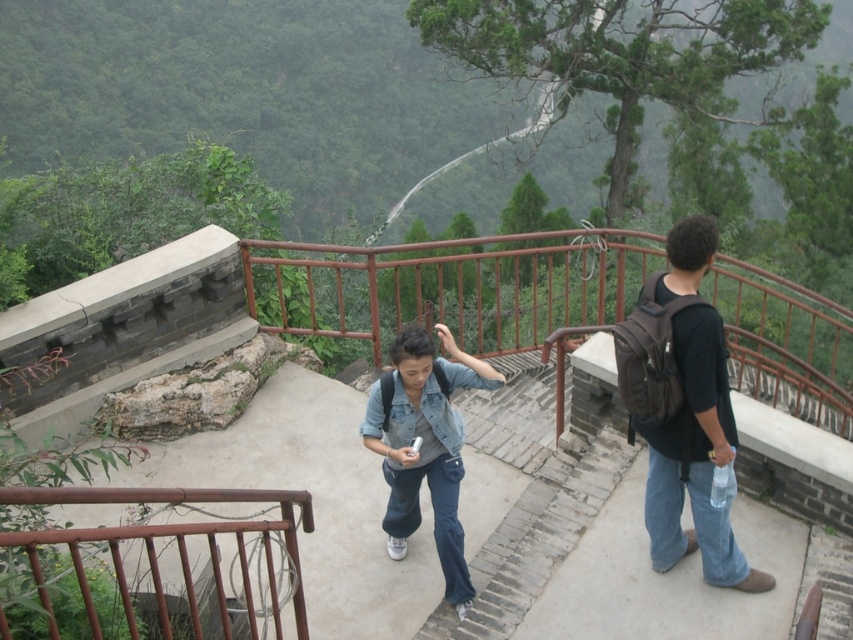
Question: Does black backpack at right appear over rusty metal railing at upper left?

Choices:
 (A) yes
 (B) no

Answer: (A)

Question: Which of the following is the farthest from the observer?

Choices:
 (A) (558, 252)
 (B) (735, 573)

Answer: (A)

Question: Which point appears farthest from the camera in this image?

Choices:
 (A) (399, 545)
 (B) (749, 289)

Answer: (B)

Question: Does rusty metal railing at center have a lesser width compared to denim jacket at center?

Choices:
 (A) no
 (B) yes

Answer: (B)

Question: Is black backpack at right to the right of denim jacket at center from the viewer's perspective?

Choices:
 (A) yes
 (B) no

Answer: (A)

Question: Which point is farther from the camera taking this photo?

Choices:
 (A) (527, 262)
 (B) (412, 337)
 (C) (677, 324)

Answer: (A)